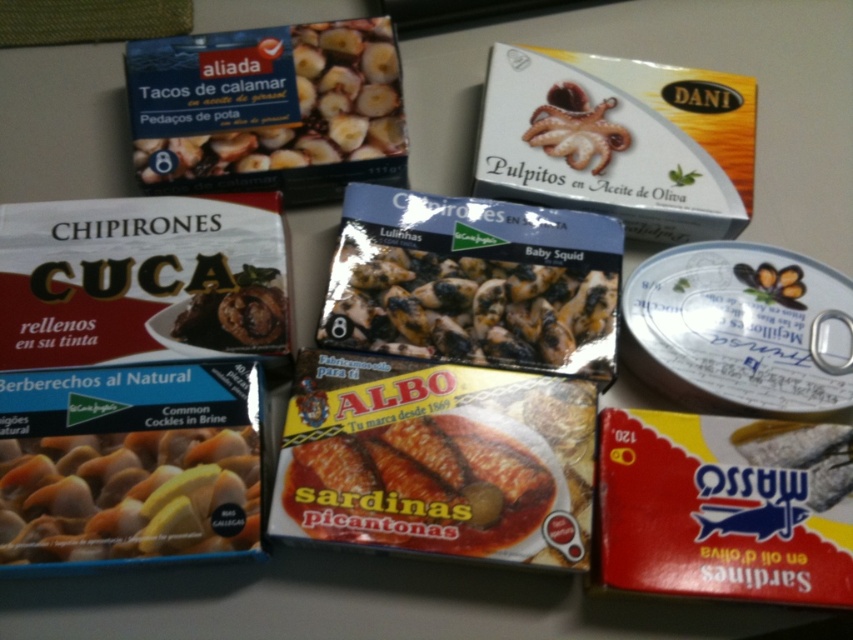
Describe the element at coordinates (128, 493) in the screenshot. I see `matte white cockles at lower left` at that location.

Can you confirm if matte white cockles at lower left is wider than yellowish matte sardines at center?

No.

Does point (155, 500) lie behind point (534, 492)?

That is False.

The height and width of the screenshot is (640, 853). Identify the location of matte white cockles at lower left. (128, 493).

Is matte cardboard box of tacos de calamar at upper left taller than black matte baby squid at center?

Correct, matte cardboard box of tacos de calamar at upper left is much taller as black matte baby squid at center.

Image resolution: width=853 pixels, height=640 pixels. Describe the element at coordinates (265, 106) in the screenshot. I see `matte cardboard box of tacos de calamar at upper left` at that location.

Locate an element on the screen. The width and height of the screenshot is (853, 640). matte cardboard box of tacos de calamar at upper left is located at coordinates (265, 106).

Identify the location of matte cardboard box of tacos de calamar at upper left. Image resolution: width=853 pixels, height=640 pixels. (265, 106).

Between point (167, 156) and point (102, 556), which one is positioned behind?

The point (167, 156) is behind.

Can you confirm if matte cardboard box of tacos de calamar at upper left is positioned to the right of matte white cockles at lower left?

Yes, matte cardboard box of tacos de calamar at upper left is to the right of matte white cockles at lower left.

At what (x,y) coordinates should I click in order to perform the action: click on matte cardboard box of tacos de calamar at upper left. Please return your answer as a coordinate pair (x, y). The height and width of the screenshot is (640, 853). Looking at the image, I should click on (265, 106).